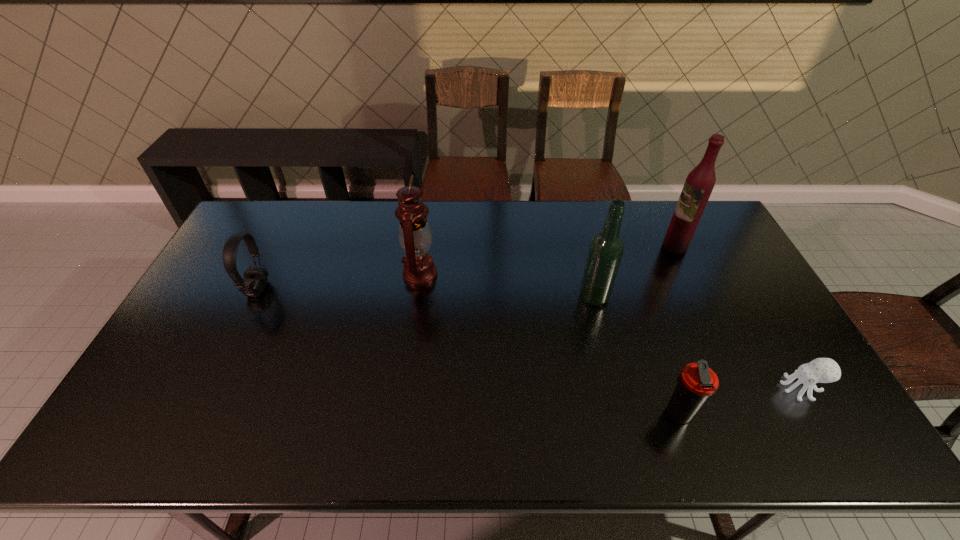
The height and width of the screenshot is (540, 960). In order to click on the second object from right to left in this screenshot , I will do `click(700, 182)`.

This screenshot has width=960, height=540. I want to click on the right liquor, so click(700, 182).

This screenshot has width=960, height=540. In order to click on the fifth object from right to left in this screenshot , I will do `click(415, 237)`.

Identify the location of the nearer liquor. (606, 249).

Find the location of a particular element. the fourth object from right to left is located at coordinates (606, 249).

At what (x,y) coordinates should I click in order to perform the action: click on the leftmost object. Please return your answer as a coordinate pair (x, y). This screenshot has height=540, width=960. Looking at the image, I should click on (255, 279).

Where is `the third object from right to left`? the third object from right to left is located at coordinates (696, 382).

The height and width of the screenshot is (540, 960). In order to click on octopus in this screenshot , I will do coord(820,370).

The width and height of the screenshot is (960, 540). I want to click on the shortest object, so click(820, 370).

The image size is (960, 540). I want to click on vacant space situated on the label of the second object from right to left, so click(x=628, y=246).